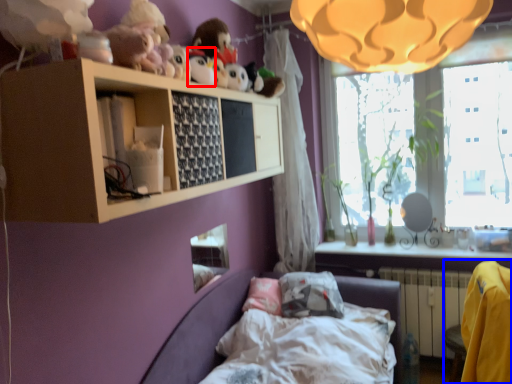
Question: Which of the following is the farthest to the observer, toy (highlighted by a red box) or armchair (highlighted by a blue box)?

Choices:
 (A) toy
 (B) armchair

Answer: (A)